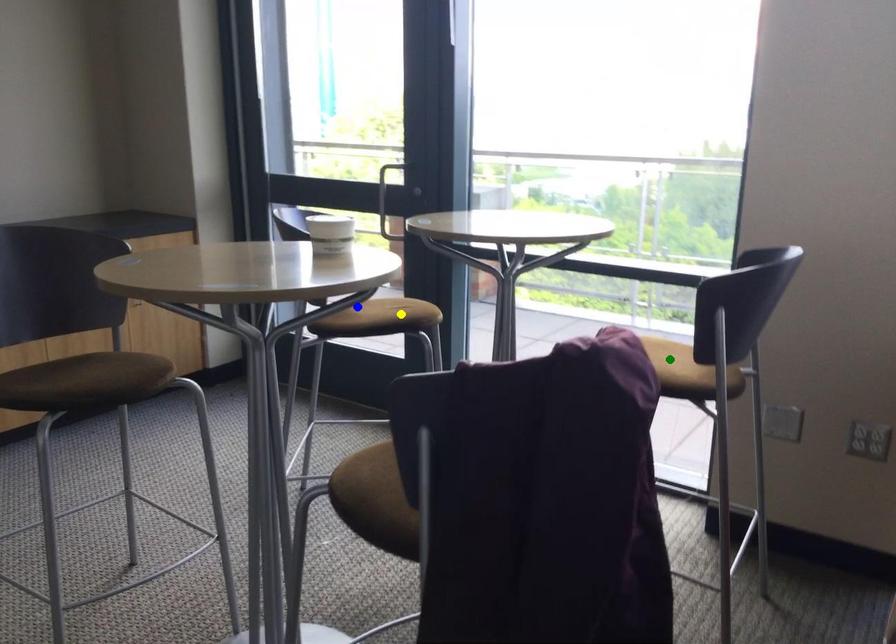
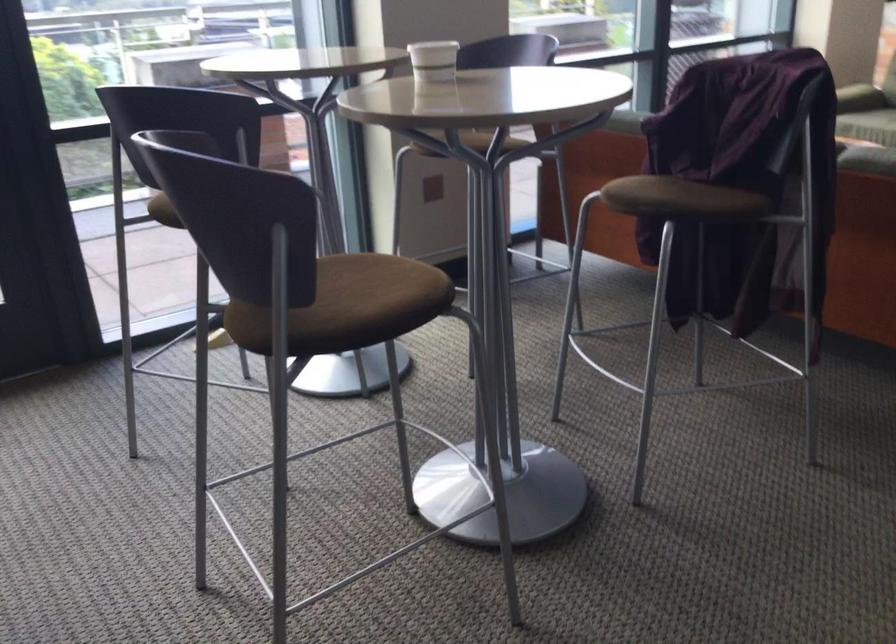
I am providing you with two images of the same scene from different viewpoints. Three points are marked in image1. Which point corresponds to a part or object that is occluded in image2?In image1, three points are marked. Which of them correspond to a part or object that is occluded in image2?Among the three points shown in image1, which one corresponds to a part or object that is no longer visible due to occlusion in image2?

green point, yellow point cannot be seen in image2.